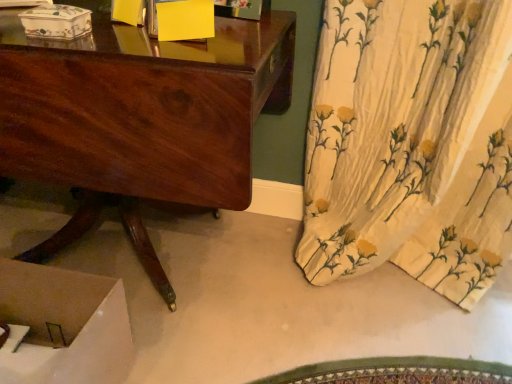
Find the location of a particular element. Image resolution: width=512 pixels, height=384 pixels. vacant space in front of yellow paper at upper center, which is counted as the first box, starting from the right is located at coordinates (181, 54).